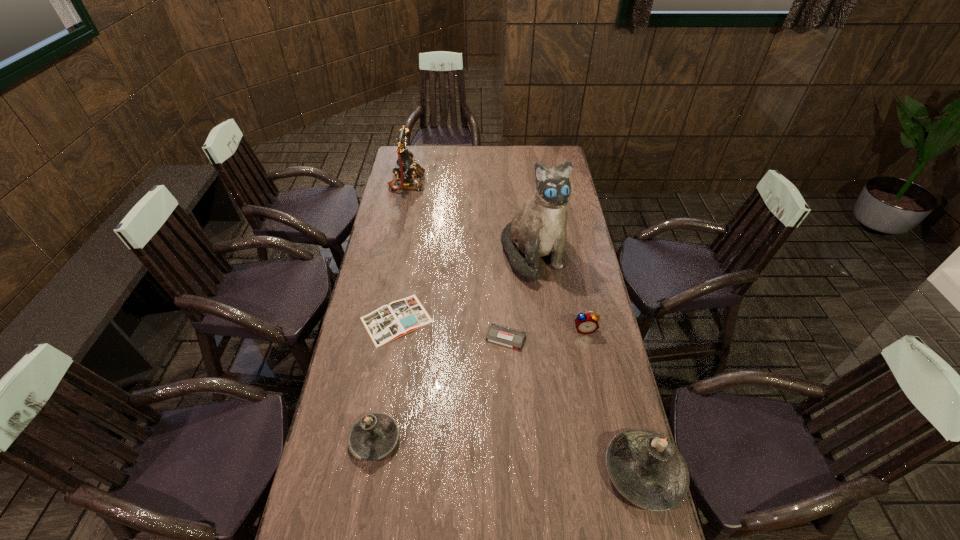
In the image, there is a desktop. Where is `vacant space at the far right corner`? This screenshot has width=960, height=540. vacant space at the far right corner is located at coordinates (548, 152).

In the image, there is a desktop. Identify the location of free space at the near right corner. The image size is (960, 540). (634, 526).

The image size is (960, 540). I want to click on vacant area that lies between the book and the shorter candle, so click(386, 379).

Where is `vacant space that's between the fifth tallest object and the videotape`? The image size is (960, 540). vacant space that's between the fifth tallest object and the videotape is located at coordinates (545, 334).

Find the location of a particular element. The height and width of the screenshot is (540, 960). free spot between the sixth shortest object and the third shortest object is located at coordinates (495, 256).

I want to click on vacant point located between the book and the third tallest object, so click(x=520, y=396).

Identify the location of free spot between the videotape and the alarm clock. (545, 334).

Locate an element on the screen. This screenshot has height=540, width=960. empty space that is in between the telephone and the alarm clock is located at coordinates (495, 256).

Where is `vacant space in between the cat and the book`? This screenshot has height=540, width=960. vacant space in between the cat and the book is located at coordinates (465, 287).

Image resolution: width=960 pixels, height=540 pixels. I want to click on free spot between the second tallest object and the fifth tallest object, so click(495, 256).